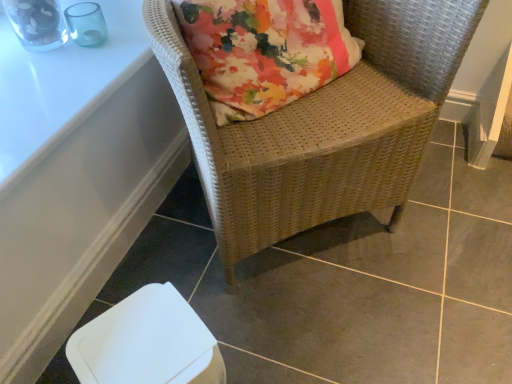
I want to click on vacant area located to the right-hand side of white plastic swivel chair at lower left, so click(276, 352).